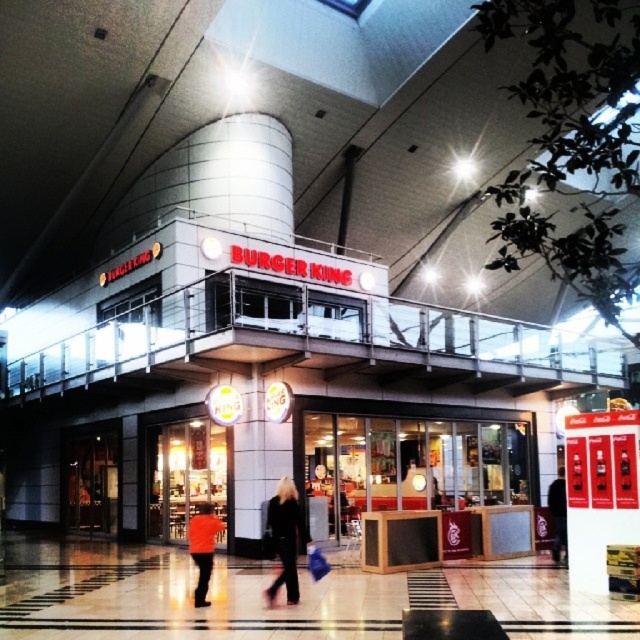
Is point (273, 536) positioned before point (196, 552)?

Yes, it is in front of point (196, 552).

Which of these two, black leather jacket at center or orange fabric jacket at lower center, stands shorter?

With less height is orange fabric jacket at lower center.

The height and width of the screenshot is (640, 640). Describe the element at coordinates (285, 538) in the screenshot. I see `black leather jacket at center` at that location.

Locate an element on the screen. black leather jacket at center is located at coordinates (285, 538).

How far apart are black leather jacket at center and black fabric jacket at center?

black leather jacket at center and black fabric jacket at center are 7.34 meters apart.

Does black leather jacket at center have a greater width compared to black fabric jacket at center?

Yes.

Identify the location of black leather jacket at center. Image resolution: width=640 pixels, height=640 pixels. (285, 538).

Is point (200, 525) positioned before point (563, 545)?

Yes, point (200, 525) is closer to viewer.

Can you confirm if orange fabric jacket at lower center is bigger than black fabric jacket at center?

Actually, orange fabric jacket at lower center might be smaller than black fabric jacket at center.

Which is in front, point (211, 545) or point (563, 548)?

Positioned in front is point (211, 545).

This screenshot has width=640, height=640. What are the coordinates of `orange fabric jacket at lower center` in the screenshot? It's located at (202, 547).